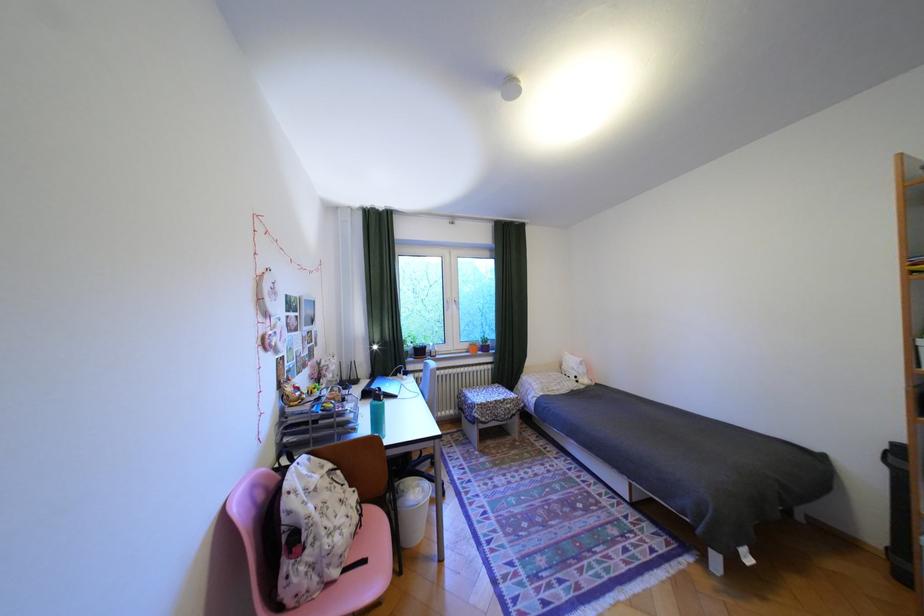
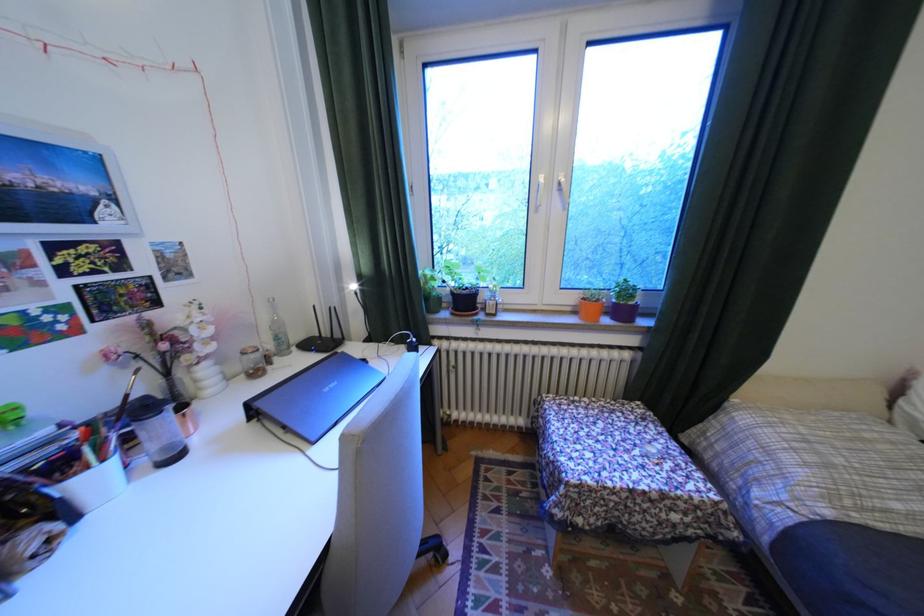
The point at (x=466, y=304) is marked in the first image. Where is the corresponding point in the second image?

(566, 195)